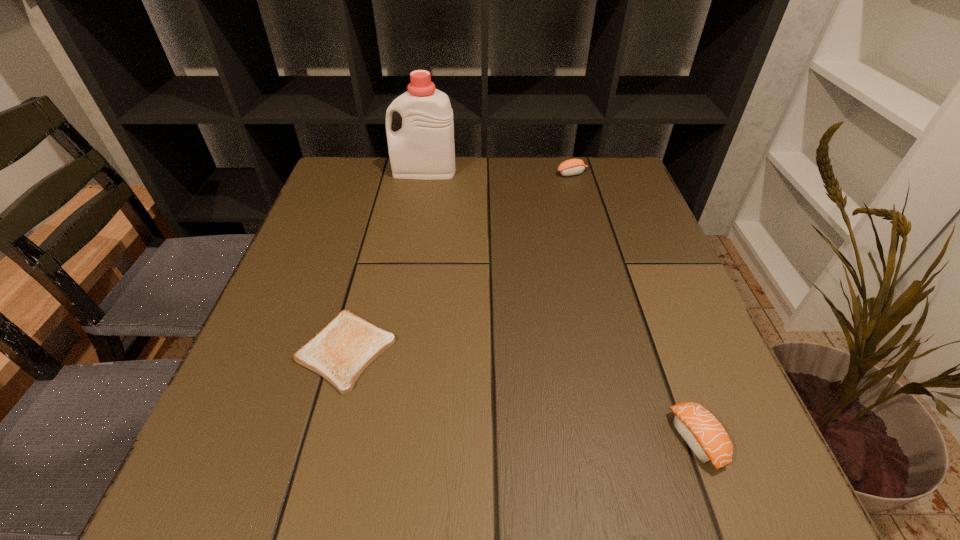
Locate an element on the screen. sushi that is at the far edge is located at coordinates (570, 167).

Where is `object that is at the near edge`? The width and height of the screenshot is (960, 540). object that is at the near edge is located at coordinates (703, 433).

At what (x,y) coordinates should I click in order to perform the action: click on object that is at the left edge. Please return your answer as a coordinate pair (x, y). Image resolution: width=960 pixels, height=540 pixels. Looking at the image, I should click on (342, 349).

Locate an element on the screen. The height and width of the screenshot is (540, 960). object situated at the far right corner is located at coordinates (570, 167).

This screenshot has width=960, height=540. I want to click on object situated at the near right corner, so click(703, 433).

This screenshot has height=540, width=960. In order to click on free space at the far edge of the desktop in this screenshot , I will do `click(444, 184)`.

In the image, there is a desktop. Where is `vacant region at the near edge`? The image size is (960, 540). vacant region at the near edge is located at coordinates (510, 509).

At what (x,y) coordinates should I click in order to perform the action: click on free region at the left edge of the desktop. Please return your answer as a coordinate pair (x, y). The height and width of the screenshot is (540, 960). Looking at the image, I should click on (341, 211).

In the image, there is a desktop. Identify the location of vacant space at the right edge. The width and height of the screenshot is (960, 540). (652, 243).

Where is `vacant area at the near left corner of the desktop`? The height and width of the screenshot is (540, 960). vacant area at the near left corner of the desktop is located at coordinates (196, 478).